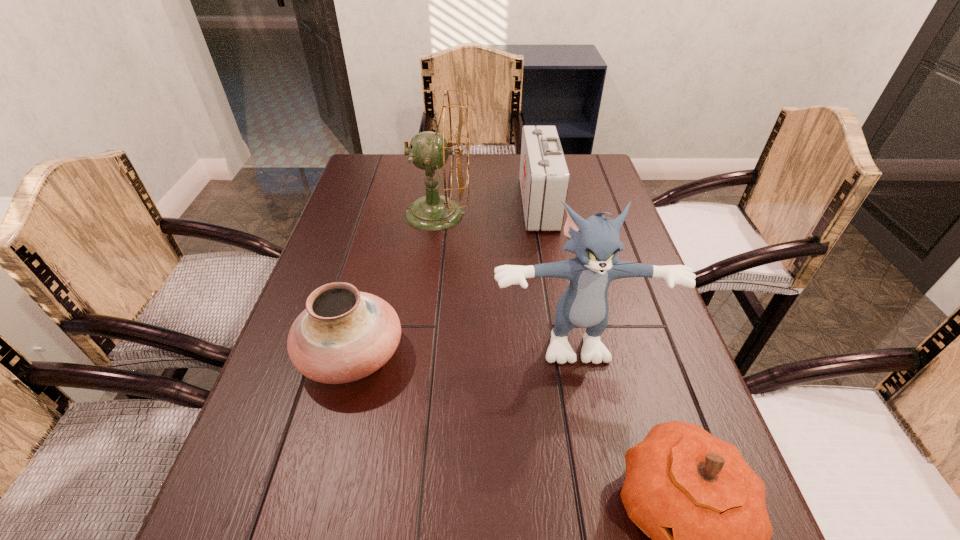
The image size is (960, 540). Identify the location of fan. (428, 150).

In order to click on cat in this screenshot , I will do `click(595, 241)`.

Identify the location of the first-aid kit. pos(544,177).

Identify the location of pottery. The image size is (960, 540). (343, 335).

Identify the location of blank area located in front of the fan, directing air flow. (562, 213).

You are a GUI agent. You are given a task and a screenshot of the screen. Output one action in this format:
    pyautogui.click(x=<x>, y=<y>)
    Task: Click on the free space located on the front-facing side of the cat
    The image size is (960, 540).
    Given the screenshot: What is the action you would take?
    pyautogui.click(x=609, y=515)

This screenshot has height=540, width=960. What are the coordinates of `blank area located 0.060m on the front-facing side of the first-aid kit` in the screenshot? It's located at (503, 203).

Find the location of a particular element. The width and height of the screenshot is (960, 540). blank space located on the front-facing side of the first-aid kit is located at coordinates (472, 203).

This screenshot has height=540, width=960. I want to click on vacant space located 0.170m on the front-facing side of the first-aid kit, so pos(467,203).

At what (x,y) coordinates should I click in order to perform the action: click on free space located on the front of the pottery. Please return your answer as a coordinate pair (x, y). The image size is (960, 540). Looking at the image, I should click on (307, 526).